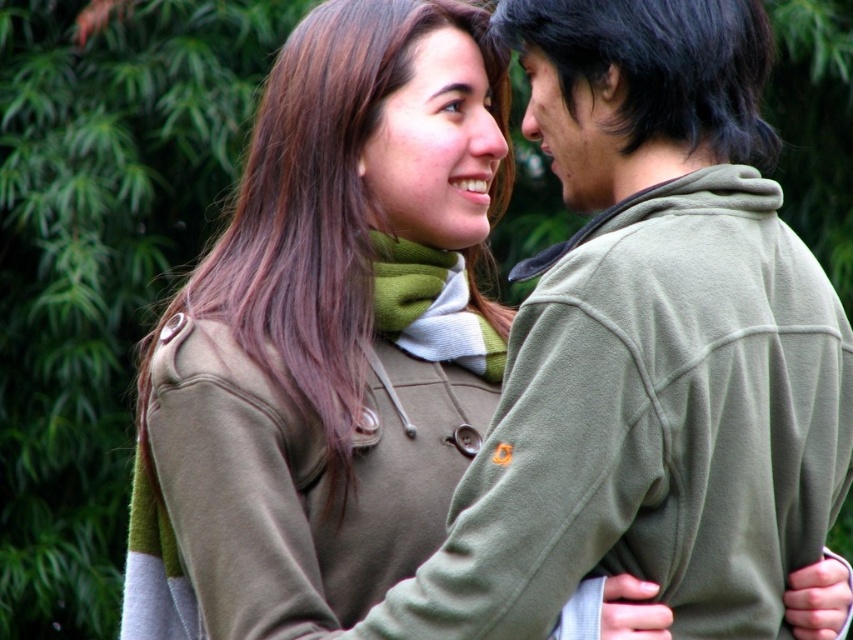
You are a photographer standing at the camera position in the scene. You want to take a photo of the two people while including the green leafy tree at upper left in the background. The camera has a focal length of 50mm. To ensure the tree is in focus along with the subjects, what adjustment should you make to the camera settings?

To ensure both the two people and the green leafy tree at upper left are in focus, you should adjust the camera aperture to a smaller opening, such as f16 or higher, which increases the depth of field. This allows for a greater range of distances to be in focus simultaneously.

You are standing at the point marked as point (12, 291) in the image. You need to throw a ball to someone standing 5.33 meters away from you. Is the person on the left or the person on the right in the image closer to you?

The point marked as point (12, 291) and the viewer are 5.33 meters apart. Therefore, the person you should throw the ball to is either the person on the left or the person on the right, but since the distance is exactly 5.33 meters, both are equally distant from you.